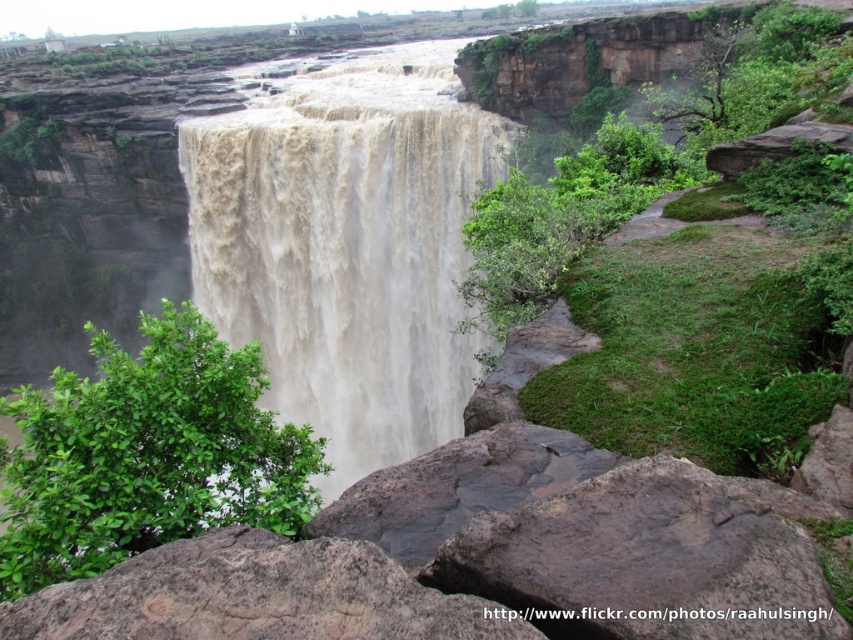
You are standing at the edge of the cliff overlooking the waterfall. You see a green leafy bush at lower left and a rusty rock at center. Which one is nearer to you?

The green leafy bush at lower left is closer to the viewer than the rusty rock at center, so the green leafy bush at lower left is nearer to you.

You are a hiker who wants to cross the river below the waterfall. You see the green leafy bush at lower left and the rusty rock at center. Which object can you use as a landmark to navigate your path?

The green leafy bush at lower left is much taller than the rusty rock at center, so it can be used as a more prominent landmark for navigation.